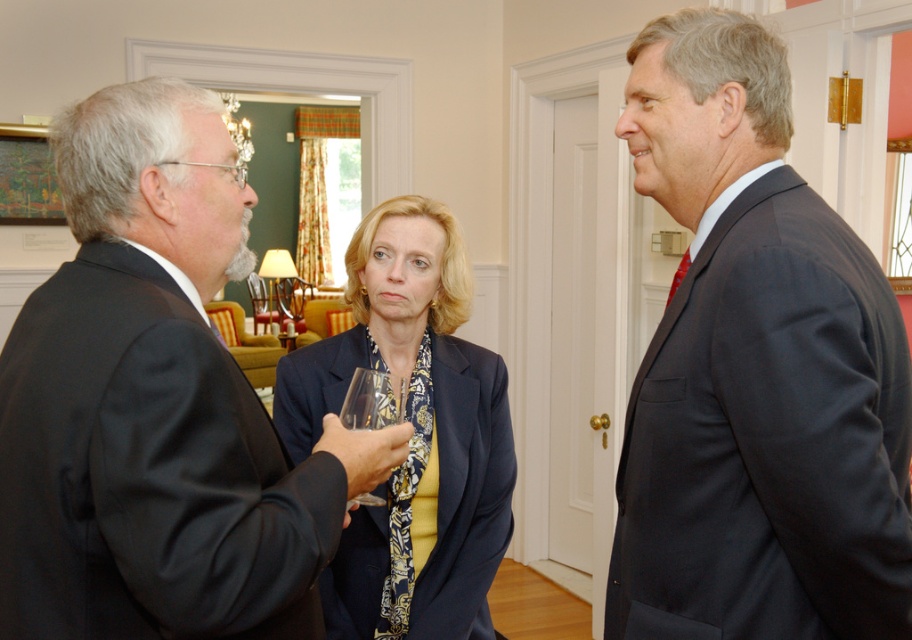
Question: Is dark blue suit at right bigger than transparent glass at center?

Choices:
 (A) no
 (B) yes

Answer: (B)

Question: Which point is farther to the camera?

Choices:
 (A) (769, 198)
 (B) (396, 385)
 (C) (350, 339)

Answer: (C)

Question: Can you confirm if black matte suit at left is wider than matte blue blazer at center?

Choices:
 (A) yes
 (B) no

Answer: (A)

Question: Can you confirm if dark blue suit at right is smaller than transparent glass at center?

Choices:
 (A) no
 (B) yes

Answer: (A)

Question: Which point is closer to the camera?

Choices:
 (A) (221, 490)
 (B) (824, 577)
 (C) (384, 380)

Answer: (A)

Question: Which object is farther from the camera taking this photo?

Choices:
 (A) transparent glass at center
 (B) dark blue suit at right
 (C) black matte suit at left
 (D) matte blue blazer at center

Answer: (D)